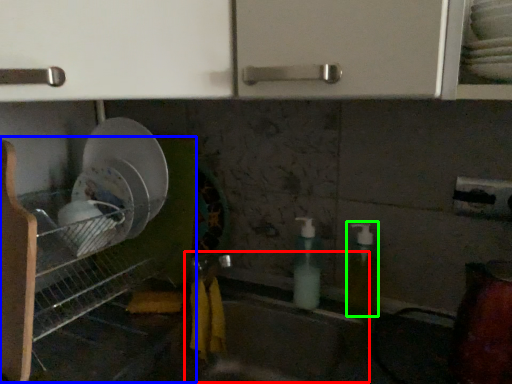
Question: Which object is the farthest from sink (highlighted by a red box)? Choose among these: shelf (highlighted by a blue box) or soap dispenser (highlighted by a green box).

Choices:
 (A) shelf
 (B) soap dispenser

Answer: (A)